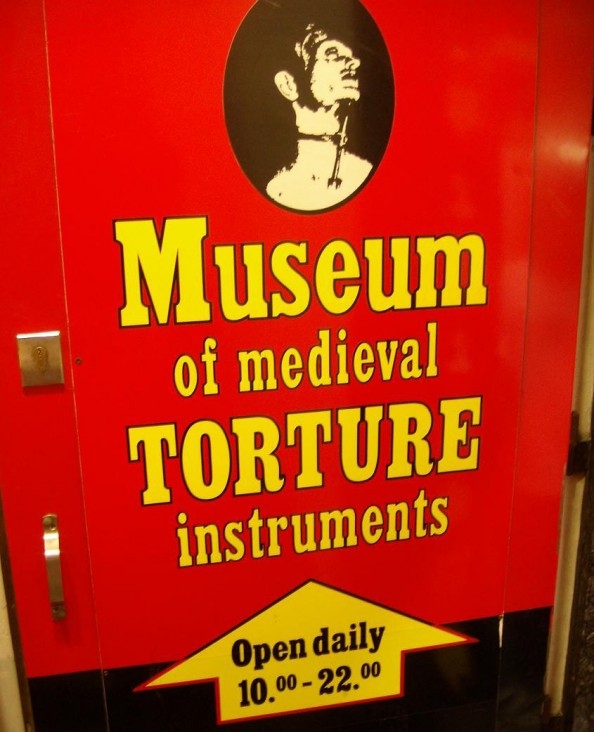
Image resolution: width=594 pixels, height=732 pixels. In order to click on handle in this screenshot , I will do `click(53, 574)`.